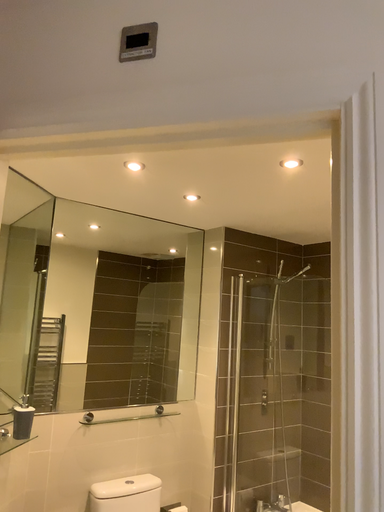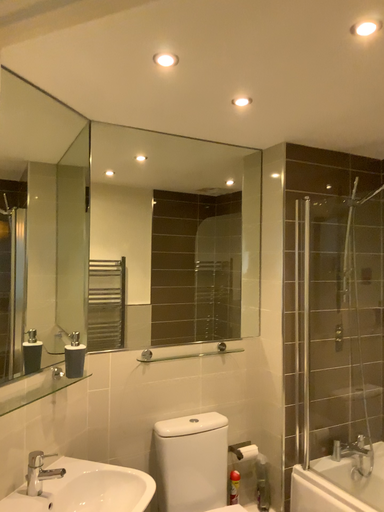
Question: How did the camera likely rotate when shooting the video?

Choices:
 (A) rotated downward
 (B) rotated upward

Answer: (A)